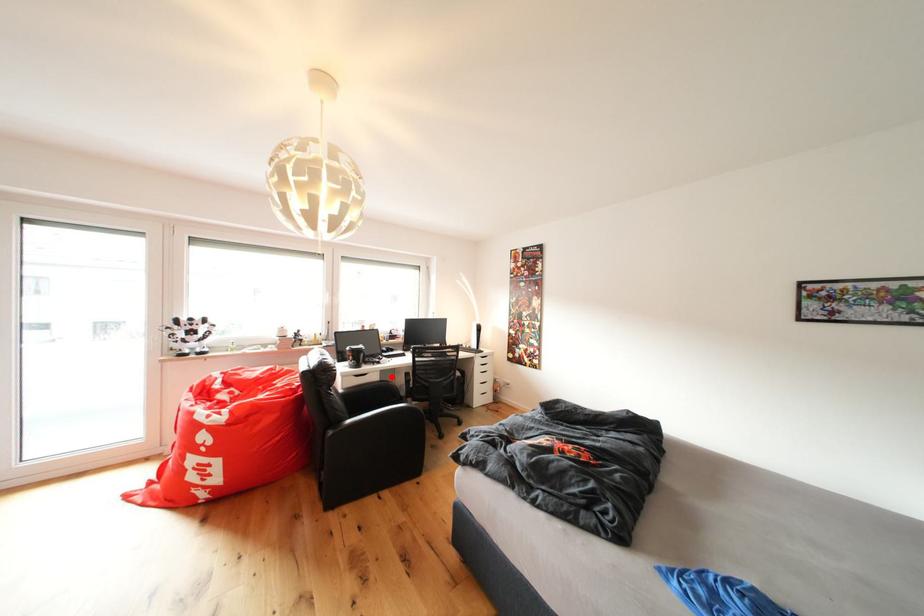
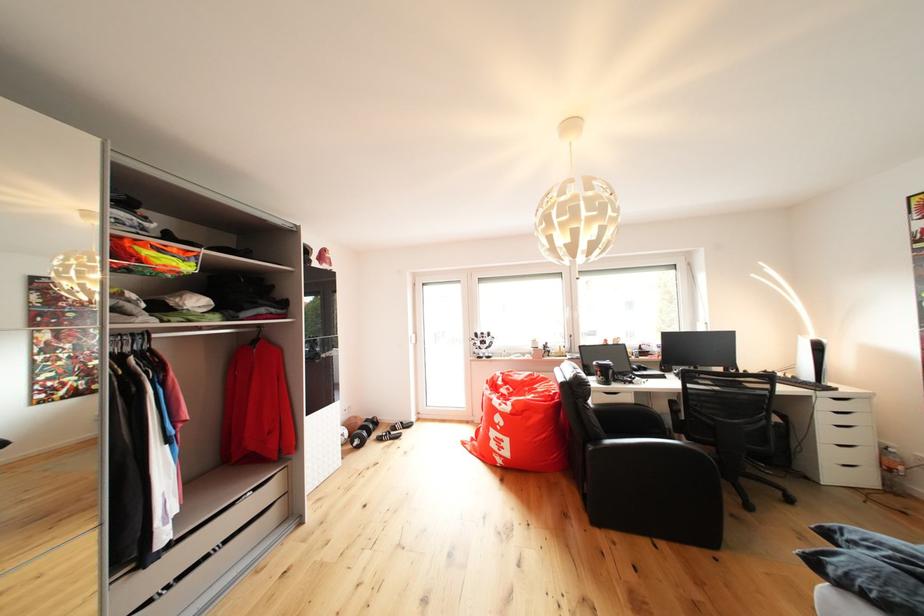
In the second image, find the point that corresponds to the highlighted location in the first image.

(647, 399)